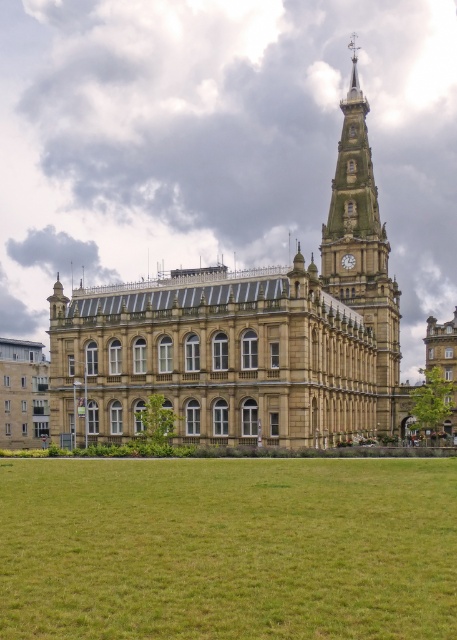
Does green grass at lower center appear on the left side of golden stone clock tower at upper right?

Indeed, green grass at lower center is positioned on the left side of golden stone clock tower at upper right.

Does point (106, 502) lie behind point (331, 292)?

No, it is in front of (331, 292).

Who is more distant from viewer, (x=388, y=515) or (x=345, y=209)?

The point (x=345, y=209) is behind.

Locate an element on the screen. green grass at lower center is located at coordinates (228, 548).